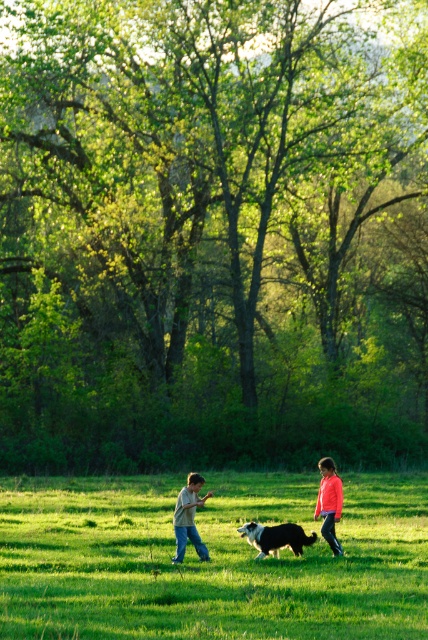
Can you confirm if green grassy field at center is taller than matte pink shirt at center?

Indeed, green grassy field at center has a greater height compared to matte pink shirt at center.

Does point (374, 506) come farther from viewer compared to point (341, 490)?

Yes, point (374, 506) is farther from viewer.

Is point (145, 554) closer to camera compared to point (329, 458)?

Yes.

This screenshot has height=640, width=428. Find the location of `green grassy field at center`. green grassy field at center is located at coordinates (210, 561).

Is light brown cotton shirt at center positioned before soft brown fur at center?

No, light brown cotton shirt at center is further to the viewer.

Between light brown cotton shirt at center and soft brown fur at center, which one is positioned lower?

soft brown fur at center is lower down.

The width and height of the screenshot is (428, 640). In order to click on light brown cotton shirt at center in this screenshot , I will do `click(189, 516)`.

Can you confirm if green grassy field at center is shorter than light brown cotton shirt at center?

Correct, green grassy field at center is not as tall as light brown cotton shirt at center.

Is point (14, 506) positioned behind point (178, 508)?

Yes, it is behind point (178, 508).

Find the location of `green grassy field at center`. green grassy field at center is located at coordinates (210, 561).